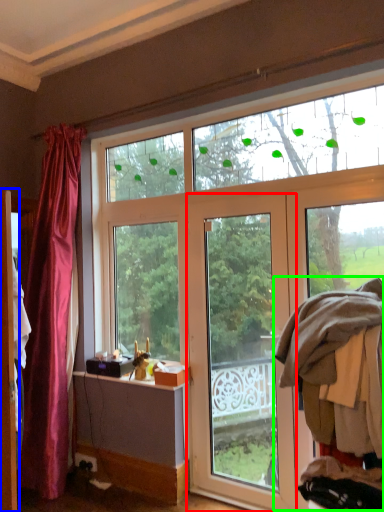
Question: Which object is the farthest from door (highlighted by a red box)? Choose among these: screen door (highlighted by a blue box) or laundry (highlighted by a green box).

Choices:
 (A) screen door
 (B) laundry

Answer: (A)